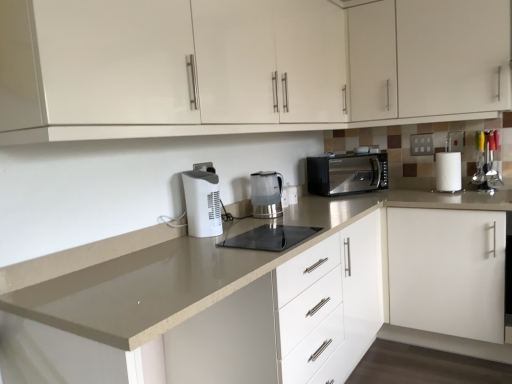
Question: Is white matte cabinet at right, which ranks as the 1th cabinetry in bottom-to-top order, located within white glossy cabinet at upper center, which is counted as the 2th cabinetry, starting from the bottom?

Choices:
 (A) no
 (B) yes

Answer: (A)

Question: From the image's perspective, is white glossy cabinet at upper center, which is counted as the second cabinetry, starting from the top, over white matte cabinet at right, which ranks as the 1th cabinetry in bottom-to-top order?

Choices:
 (A) no
 (B) yes

Answer: (B)

Question: Is white glossy cabinet at upper center, which is counted as the 2th cabinetry, starting from the bottom, positioned before white matte cabinet at right, which ranks as the 1th cabinetry in bottom-to-top order?

Choices:
 (A) no
 (B) yes

Answer: (B)

Question: Is white glossy cabinet at upper center, which is counted as the second cabinetry, starting from the top, looking in the opposite direction of white matte cabinet at right, which ranks as the 1th cabinetry in bottom-to-top order?

Choices:
 (A) yes
 (B) no

Answer: (B)

Question: Can you confirm if white glossy cabinet at upper center, which is counted as the second cabinetry, starting from the top, is taller than white matte cabinet at right, placed as the 3th cabinetry when sorted from top to bottom?

Choices:
 (A) yes
 (B) no

Answer: (B)

Question: From a real-world perspective, is white glossy cabinet at upper center, which is counted as the 2th cabinetry, starting from the bottom, physically above white matte cabinet at right, placed as the 3th cabinetry when sorted from top to bottom?

Choices:
 (A) no
 (B) yes

Answer: (B)

Question: From a real-world perspective, is transparent plastic kettle at center, which is the first home appliance in right-to-left order, positioned under beige laminate countertop at center based on gravity?

Choices:
 (A) yes
 (B) no

Answer: (B)

Question: Are transparent plastic kettle at center, acting as the second home appliance starting from the front, and beige laminate countertop at center located far from each other?

Choices:
 (A) no
 (B) yes

Answer: (A)

Question: Is transparent plastic kettle at center, which is the first home appliance in right-to-left order, positioned before beige laminate countertop at center?

Choices:
 (A) yes
 (B) no

Answer: (B)

Question: Can you confirm if transparent plastic kettle at center, placed as the first home appliance when sorted from back to front, is taller than beige laminate countertop at center?

Choices:
 (A) yes
 (B) no

Answer: (B)

Question: Is transparent plastic kettle at center, acting as the second home appliance starting from the front, in contact with beige laminate countertop at center?

Choices:
 (A) no
 (B) yes

Answer: (A)

Question: Considering the relative positions of transparent plastic kettle at center, placed as the first home appliance when sorted from back to front, and beige laminate countertop at center in the image provided, is transparent plastic kettle at center, placed as the first home appliance when sorted from back to front, behind beige laminate countertop at center?

Choices:
 (A) yes
 (B) no

Answer: (A)

Question: Does beige laminate countertop at center have a lesser width compared to white glossy cabinet at upper center, which is the first cabinetry from top to bottom?

Choices:
 (A) yes
 (B) no

Answer: (B)